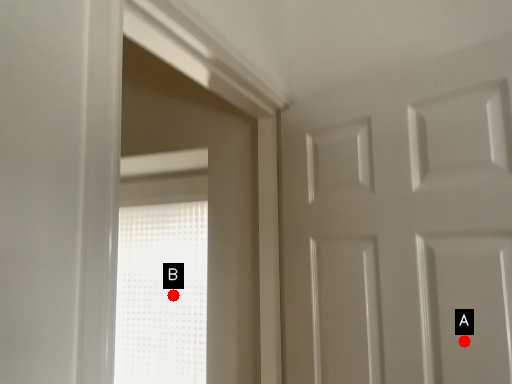
Question: Two points are circled on the image, labeled by A and B beside each circle. Which of the following is the closest to the observer?

Choices:
 (A) A is closer
 (B) B is closer

Answer: (A)